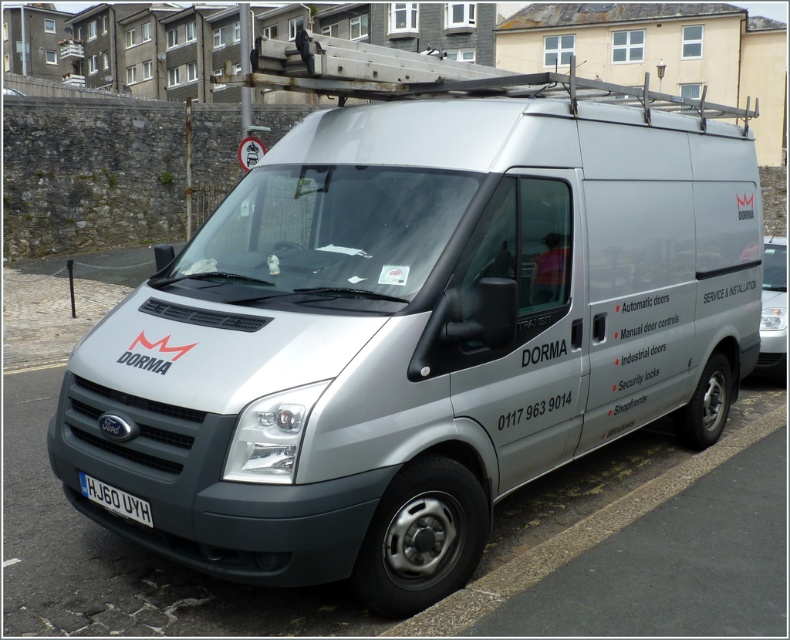
You are a delivery driver who needs to park your van close to the curb. The parking space is narrow. Based on the image, can you safely park your van so that the white plastic license plate at lower center is 3 meters away from the gray asphalt curb at lower right?

The distance between the gray asphalt curb at lower right and the white plastic license plate at lower center is 3.09 meters, which is slightly more than 3 meters. Therefore, you can safely park the van so that the white plastic license plate at lower center is 3 meters away from the gray asphalt curb at lower right.

You are standing in front of the silver Ford Transit van and want to touch both points on the van. Which point should you reach for first, the point at coordinate [514,556] or the point at coordinate [138,515]?

You should reach for point [514,556] first because it is closer to you than point [138,515].

You are a delivery driver who just arrived at the location shown in the image. You need to park your car so that its front bumper aligns with the gray asphalt curb at lower right. What are the coordinates where you should position your car?

The coordinates for the gray asphalt curb at lower right are at point (576, 538). Position your car so that its front bumper aligns with these coordinates.